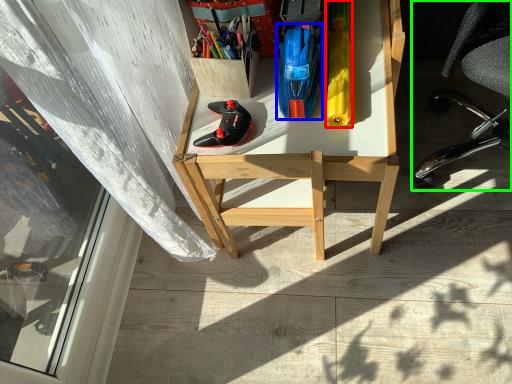
Question: Based on their relative distances, which object is nearer to stationery (highlighted by a red box)? Choose from stationery (highlighted by a blue box) and chair (highlighted by a green box).

Choices:
 (A) stationery
 (B) chair

Answer: (A)